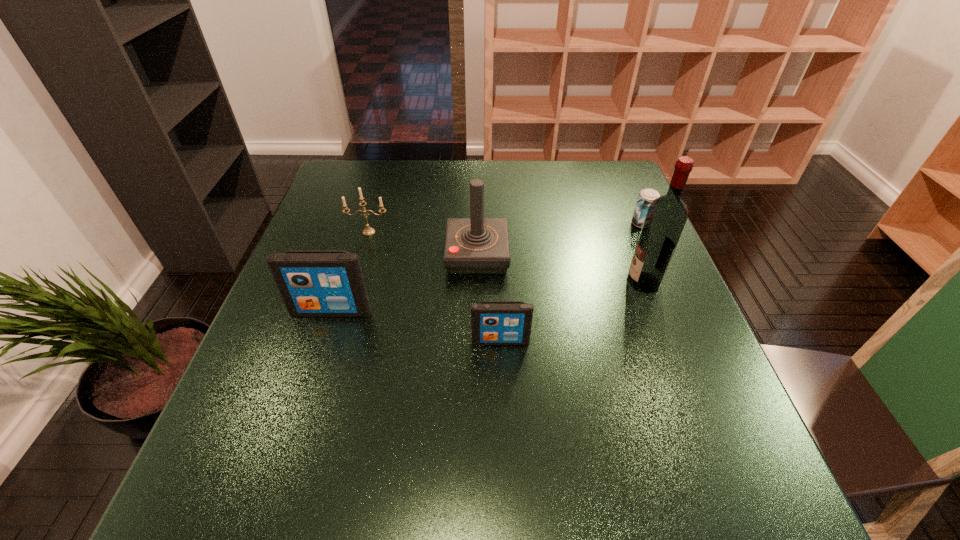
Where is `free space between the third shortest object and the second tallest object`? This screenshot has height=540, width=960. free space between the third shortest object and the second tallest object is located at coordinates (423, 244).

Identify which object is the second nearest to the joystick. Please provide its 2D coordinates. Your answer should be formatted as a tuple, i.e. [(x, y)], where the tuple contains the x and y coordinates of a point satisfying the conditions above.

[(313, 283)]

Where is `object identified as the fifth closest to the candle`? object identified as the fifth closest to the candle is located at coordinates (646, 196).

Identify the location of free space that satisfies the following two spatial constraints: 1. on the rectangular base of the fifth shortest object; 2. on the front screen of the taller iPod. (477, 312).

This screenshot has width=960, height=540. I want to click on vacant area that satisfies the following two spatial constraints: 1. on the rectangular base of the joystick; 2. on the front screen of the farther iPod, so click(x=477, y=312).